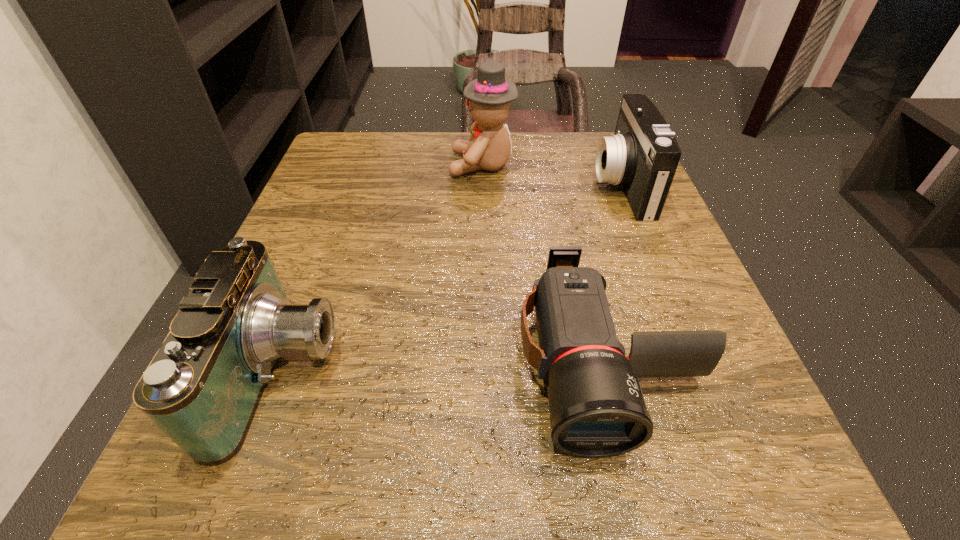
In order to click on vacant point located 0.290m on the front-facing side of the leftmost camcorder in this screenshot , I will do `click(551, 373)`.

Where is `vacant space located on the lens of the shortest object`? The height and width of the screenshot is (540, 960). vacant space located on the lens of the shortest object is located at coordinates tap(641, 505).

I want to click on rag_doll situated at the far edge, so click(488, 97).

Locate an element on the screen. camcorder that is at the far edge is located at coordinates (643, 154).

What are the coordinates of `object present at the left edge` in the screenshot? It's located at (202, 388).

Image resolution: width=960 pixels, height=540 pixels. Identify the location of object that is at the near left corner. (202, 388).

I want to click on object positioned at the far right corner, so click(643, 154).

Locate an element on the screen. object at the near right corner is located at coordinates (597, 409).

Image resolution: width=960 pixels, height=540 pixels. In order to click on vacant region at the far edge of the desktop in this screenshot , I will do `click(512, 179)`.

Image resolution: width=960 pixels, height=540 pixels. What are the coordinates of `vacant area at the near edge of the desktop` in the screenshot? It's located at (474, 447).